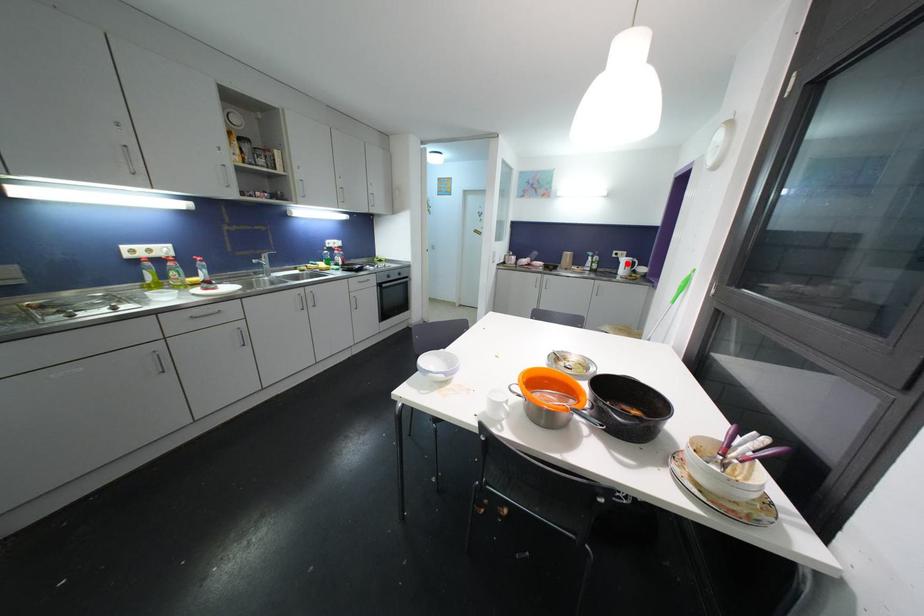
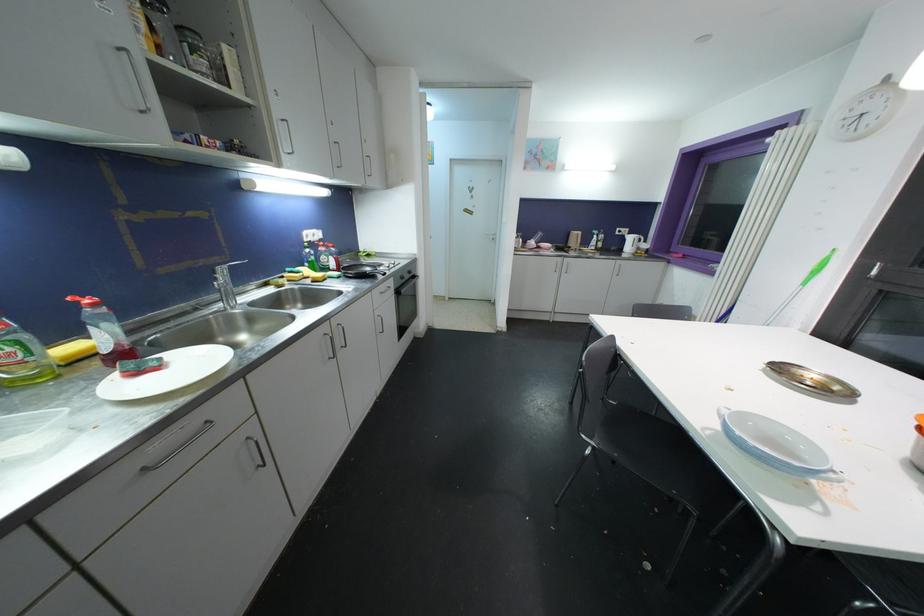
The point at the highlighted location is marked in the first image. Where is the corresponding point in the second image?

(634, 241)